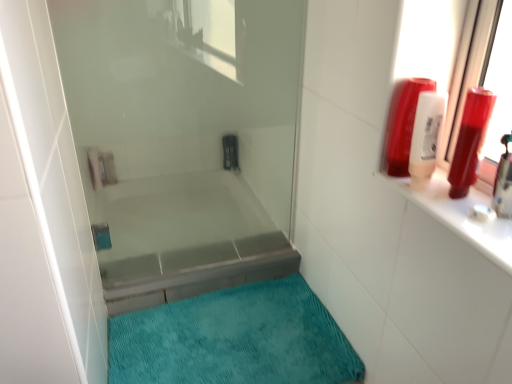
The height and width of the screenshot is (384, 512). What do you see at coordinates (426, 137) in the screenshot?
I see `translucent plastic shampoo bottle at upper right, placed as the 2th toiletry when sorted from right to left` at bounding box center [426, 137].

The height and width of the screenshot is (384, 512). What do you see at coordinates (234, 339) in the screenshot?
I see `teal plush bath mat at lower center` at bounding box center [234, 339].

Locate an element on the screen. teal plush bath mat at lower center is located at coordinates (234, 339).

Describe the element at coordinates (187, 239) in the screenshot. I see `metallic silver bathtub at center` at that location.

Find the location of `translucent plastic shampoo bottle at upper right, arranged as the 2th toiletry when viewed from the left`. translucent plastic shampoo bottle at upper right, arranged as the 2th toiletry when viewed from the left is located at coordinates (426, 137).

Looking at this image, considering the sizes of objects transparent glass shower door at center and matte plastic shampoo bottle at upper right, positioned as the 3th toiletry in right-to-left order, in the image provided, who is shorter, transparent glass shower door at center or matte plastic shampoo bottle at upper right, positioned as the 3th toiletry in right-to-left order,?

matte plastic shampoo bottle at upper right, positioned as the 3th toiletry in right-to-left order.

Based on their sizes in the image, would you say transparent glass shower door at center is bigger or smaller than matte plastic shampoo bottle at upper right, which is counted as the first toiletry, starting from the left?

transparent glass shower door at center is bigger than matte plastic shampoo bottle at upper right, which is counted as the first toiletry, starting from the left.

How different are the orientations of transparent glass shower door at center and matte plastic shampoo bottle at upper right, which is counted as the first toiletry, starting from the left, in degrees?

The angular difference between transparent glass shower door at center and matte plastic shampoo bottle at upper right, which is counted as the first toiletry, starting from the left, is 1.14 degrees.

Considering the points (170, 217) and (387, 123), which point is behind, point (170, 217) or point (387, 123)?

The point (170, 217) is more distant.

Does point (470, 150) come closer to viewer compared to point (359, 374)?

That is True.

Is shiny plastic bottle at upper right, placed as the 3th toiletry when sorted from left to right, positioned beyond the bounds of teal plush bath mat at lower center?

Yes.

Does shiny plastic bottle at upper right, the 1th toiletry from the right, appear on the right side of teal plush bath mat at lower center?

Yes, shiny plastic bottle at upper right, the 1th toiletry from the right, is to the right of teal plush bath mat at lower center.

Is translucent plastic shampoo bottle at upper right, arranged as the 2th toiletry when viewed from the left, completely or partially outside of transparent glass shower door at center?

translucent plastic shampoo bottle at upper right, arranged as the 2th toiletry when viewed from the left, is positioned outside transparent glass shower door at center.

Looking at this image, is translucent plastic shampoo bottle at upper right, placed as the 2th toiletry when sorted from right to left, wider or thinner than transparent glass shower door at center?

A: Clearly, translucent plastic shampoo bottle at upper right, placed as the 2th toiletry when sorted from right to left, has more width compared to transparent glass shower door at center.

From the image's perspective, is translucent plastic shampoo bottle at upper right, arranged as the 2th toiletry when viewed from the left, located above transparent glass shower door at center?

No, from the image's perspective, translucent plastic shampoo bottle at upper right, arranged as the 2th toiletry when viewed from the left, is not above transparent glass shower door at center.

Is translucent plastic shampoo bottle at upper right, arranged as the 2th toiletry when viewed from the left, far from transparent glass shower door at center?

No, translucent plastic shampoo bottle at upper right, arranged as the 2th toiletry when viewed from the left, is not far from transparent glass shower door at center.

What's the angular difference between transparent glass shower door at center and translucent plastic shampoo bottle at upper right, placed as the 2th toiletry when sorted from right to left,'s facing directions?

They differ by 1.14 degrees in their facing directions.

Can you see transparent glass shower door at center touching translucent plastic shampoo bottle at upper right, placed as the 2th toiletry when sorted from right to left?

transparent glass shower door at center and translucent plastic shampoo bottle at upper right, placed as the 2th toiletry when sorted from right to left, are clearly separated.

Looking at this image, can you confirm if transparent glass shower door at center is taller than translucent plastic shampoo bottle at upper right, arranged as the 2th toiletry when viewed from the left?

Correct, transparent glass shower door at center is much taller as translucent plastic shampoo bottle at upper right, arranged as the 2th toiletry when viewed from the left.

Considering the sizes of objects transparent glass shower door at center and translucent plastic shampoo bottle at upper right, placed as the 2th toiletry when sorted from right to left, in the image provided, who is bigger, transparent glass shower door at center or translucent plastic shampoo bottle at upper right, placed as the 2th toiletry when sorted from right to left,?

With larger size is transparent glass shower door at center.

Is point (475, 111) positioned in front of point (403, 81)?

Yes, it is.

From the image's perspective, starting from the matte plastic shampoo bottle at upper right, positioned as the 3th toiletry in right-to-left order, which toiletry is the 2nd one below? Please provide its 2D coordinates.

[(470, 140)]

Is shiny plastic bottle at upper right, placed as the 3th toiletry when sorted from left to right, touching matte plastic shampoo bottle at upper right, positioned as the 3th toiletry in right-to-left order?

No, shiny plastic bottle at upper right, placed as the 3th toiletry when sorted from left to right, is not with matte plastic shampoo bottle at upper right, positioned as the 3th toiletry in right-to-left order.

What's the angular difference between matte plastic shampoo bottle at upper right, which is counted as the first toiletry, starting from the left, and translucent plastic shampoo bottle at upper right, arranged as the 2th toiletry when viewed from the left,'s facing directions?

0.00316 degrees separate the facing orientations of matte plastic shampoo bottle at upper right, which is counted as the first toiletry, starting from the left, and translucent plastic shampoo bottle at upper right, arranged as the 2th toiletry when viewed from the left.

Is the surface of matte plastic shampoo bottle at upper right, which is counted as the first toiletry, starting from the left, in direct contact with translucent plastic shampoo bottle at upper right, arranged as the 2th toiletry when viewed from the left?

Yes, matte plastic shampoo bottle at upper right, which is counted as the first toiletry, starting from the left, is next to translucent plastic shampoo bottle at upper right, arranged as the 2th toiletry when viewed from the left.

Which object is positioned more to the right, matte plastic shampoo bottle at upper right, which is counted as the first toiletry, starting from the left, or translucent plastic shampoo bottle at upper right, arranged as the 2th toiletry when viewed from the left?

translucent plastic shampoo bottle at upper right, arranged as the 2th toiletry when viewed from the left.

Relative to translucent plastic shampoo bottle at upper right, placed as the 2th toiletry when sorted from right to left, is matte plastic shampoo bottle at upper right, which is counted as the first toiletry, starting from the left, in front or behind?

Visually, matte plastic shampoo bottle at upper right, which is counted as the first toiletry, starting from the left, is located behind translucent plastic shampoo bottle at upper right, placed as the 2th toiletry when sorted from right to left.

Between translucent plastic shampoo bottle at upper right, arranged as the 2th toiletry when viewed from the left, and metallic silver bathtub at center, which one is positioned behind?

metallic silver bathtub at center is more distant.

Can you confirm if translucent plastic shampoo bottle at upper right, placed as the 2th toiletry when sorted from right to left, is positioned to the right of metallic silver bathtub at center?

Indeed, translucent plastic shampoo bottle at upper right, placed as the 2th toiletry when sorted from right to left, is positioned on the right side of metallic silver bathtub at center.

Where is `the 1st toiletry positioned above the metallic silver bathtub at center (from a real-world perspective)`? Image resolution: width=512 pixels, height=384 pixels. the 1st toiletry positioned above the metallic silver bathtub at center (from a real-world perspective) is located at coordinates (426, 137).

Is translucent plastic shampoo bottle at upper right, arranged as the 2th toiletry when viewed from the left, oriented away from metallic silver bathtub at center?

That's not correct — translucent plastic shampoo bottle at upper right, arranged as the 2th toiletry when viewed from the left, is not looking away from metallic silver bathtub at center.

There is a transparent glass shower door at center. At what (x,y) coordinates should I click in order to perform the action: click on the 3rd toiletry above it (from a real-world perspective). Please return your answer as a coordinate pair (x, y). Looking at the image, I should click on (402, 125).

The image size is (512, 384). In order to click on the 3rd toiletry in front of the teal plush bath mat at lower center, counting from the anchor's position in this screenshot , I will do `click(470, 140)`.

Based on their spatial positions, is translucent plastic shampoo bottle at upper right, arranged as the 2th toiletry when viewed from the left, or shiny plastic bottle at upper right, the 1th toiletry from the right, further from teal plush bath mat at lower center?

shiny plastic bottle at upper right, the 1th toiletry from the right, lies further to teal plush bath mat at lower center than the other object.

Considering their positions, is matte plastic shampoo bottle at upper right, positioned as the 3th toiletry in right-to-left order, positioned further to metallic silver bathtub at center than teal plush bath mat at lower center?

Among the two, matte plastic shampoo bottle at upper right, positioned as the 3th toiletry in right-to-left order, is located further to metallic silver bathtub at center.

Which object lies further to the anchor point teal plush bath mat at lower center, matte plastic shampoo bottle at upper right, positioned as the 3th toiletry in right-to-left order, or shiny plastic bottle at upper right, the 1th toiletry from the right?

shiny plastic bottle at upper right, the 1th toiletry from the right, lies further to teal plush bath mat at lower center than the other object.

From the image, which object appears to be nearer to transparent glass shower door at center, matte plastic shampoo bottle at upper right, positioned as the 3th toiletry in right-to-left order, or shiny plastic bottle at upper right, placed as the 3th toiletry when sorted from left to right?

The object closer to transparent glass shower door at center is matte plastic shampoo bottle at upper right, positioned as the 3th toiletry in right-to-left order.

Considering their positions, is translucent plastic shampoo bottle at upper right, arranged as the 2th toiletry when viewed from the left, positioned closer to shiny plastic bottle at upper right, placed as the 3th toiletry when sorted from left to right, than teal plush bath mat at lower center?

translucent plastic shampoo bottle at upper right, arranged as the 2th toiletry when viewed from the left, is closer to shiny plastic bottle at upper right, placed as the 3th toiletry when sorted from left to right.

Looking at the image, which one is located closer to translucent plastic shampoo bottle at upper right, placed as the 2th toiletry when sorted from right to left, shiny plastic bottle at upper right, the 1th toiletry from the right, or metallic silver bathtub at center?

shiny plastic bottle at upper right, the 1th toiletry from the right.

Considering their positions, is transparent glass shower door at center positioned further to teal plush bath mat at lower center than matte plastic shampoo bottle at upper right, which is counted as the first toiletry, starting from the left?

matte plastic shampoo bottle at upper right, which is counted as the first toiletry, starting from the left.

When comparing their distances from matte plastic shampoo bottle at upper right, positioned as the 3th toiletry in right-to-left order, does transparent glass shower door at center or teal plush bath mat at lower center seem further?

Among the two, transparent glass shower door at center is located further to matte plastic shampoo bottle at upper right, positioned as the 3th toiletry in right-to-left order.

Identify the location of shower door between matte plastic shampoo bottle at upper right, which is counted as the first toiletry, starting from the left, and teal plush bath mat at lower center in the up-down direction. The height and width of the screenshot is (384, 512). (185, 140).

The image size is (512, 384). Find the location of `toiletry situated between metallic silver bathtub at center and translucent plastic shampoo bottle at upper right, placed as the 2th toiletry when sorted from right to left, from left to right`. toiletry situated between metallic silver bathtub at center and translucent plastic shampoo bottle at upper right, placed as the 2th toiletry when sorted from right to left, from left to right is located at coordinates (402, 125).

Where is `toiletry between transparent glass shower door at center and translucent plastic shampoo bottle at upper right, arranged as the 2th toiletry when viewed from the left`? toiletry between transparent glass shower door at center and translucent plastic shampoo bottle at upper right, arranged as the 2th toiletry when viewed from the left is located at coordinates (402, 125).

You are a GUI agent. You are given a task and a screenshot of the screen. Output one action in this format:
    pyautogui.click(x=<x>, y=<y>)
    Task: Click on the bathtub between transparent glass shower door at center and teal plush bath mat at lower center in the up-down direction
    
    Given the screenshot: What is the action you would take?
    pyautogui.click(x=187, y=239)